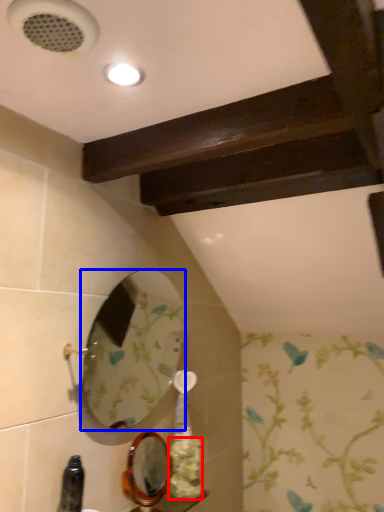
Question: Which object appears farthest to the camera in this image, flower (highlighted by a red box) or mirror (highlighted by a blue box)?

Choices:
 (A) flower
 (B) mirror

Answer: (A)